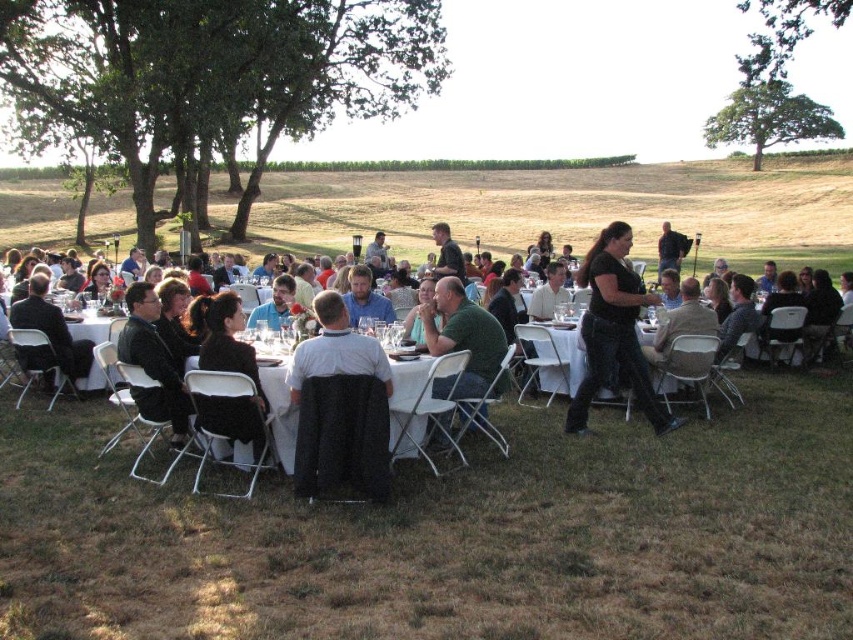
Question: Which point is farther to the camera?

Choices:
 (A) (456, 301)
 (B) (294, 426)

Answer: (A)

Question: Is black textured jacket at center to the right of black matte dress at center from the viewer's perspective?

Choices:
 (A) no
 (B) yes

Answer: (A)

Question: Which point is farther to the camera?

Choices:
 (A) (363, 360)
 (B) (267, 380)
 (C) (630, 300)
 (D) (234, 360)

Answer: (C)

Question: Does black fabric table at center appear on the left side of white glossy table at center?

Choices:
 (A) no
 (B) yes

Answer: (B)

Question: Is black fabric table at center positioned before white glossy table at center?

Choices:
 (A) no
 (B) yes

Answer: (B)

Question: Among these points, which one is farthest from the camera?

Choices:
 (A) (390, 433)
 (B) (621, 392)

Answer: (B)